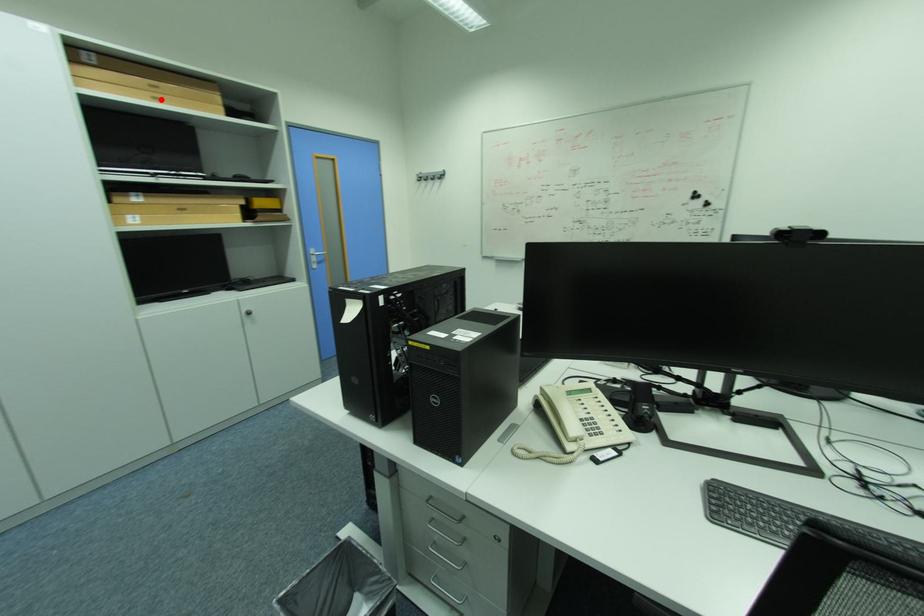
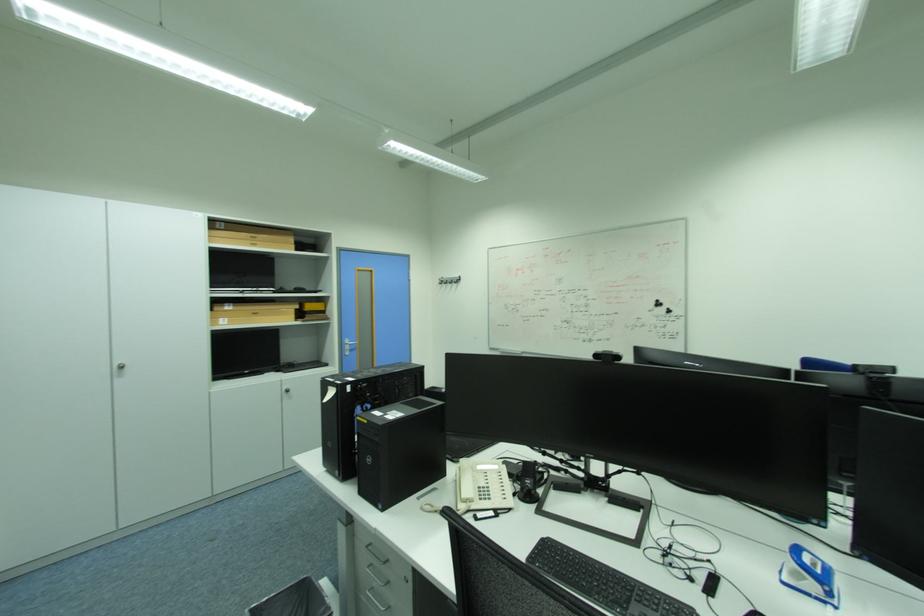
The point at the highlighted location is marked in the first image. Where is the corresponding point in the second image?

(261, 246)